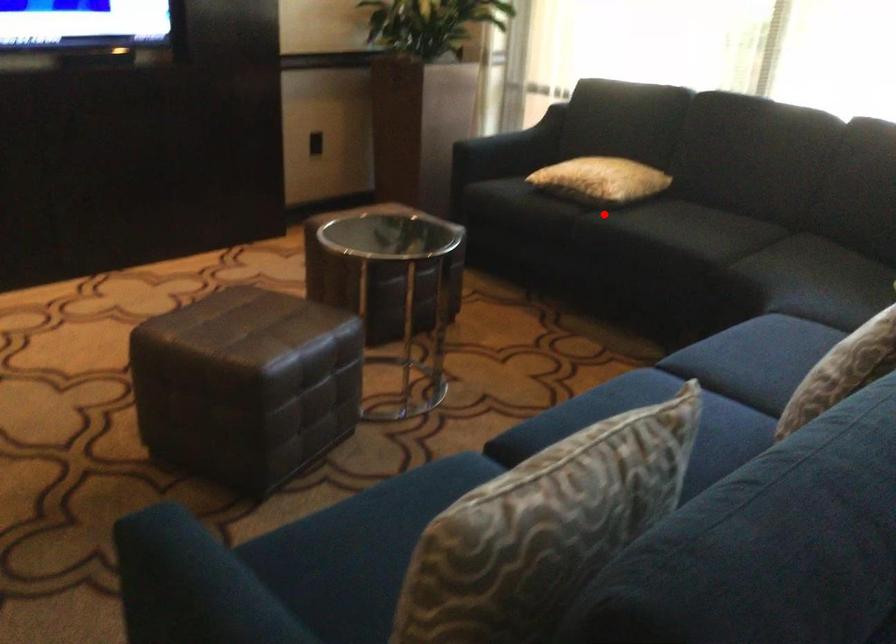
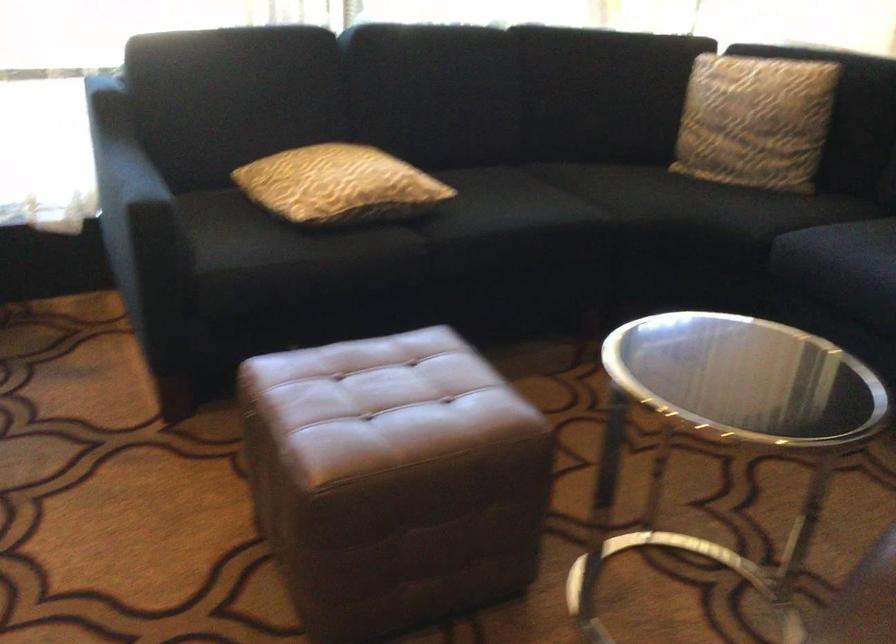
In the second image, find the point that corresponds to the highlighted location in the first image.

(426, 227)